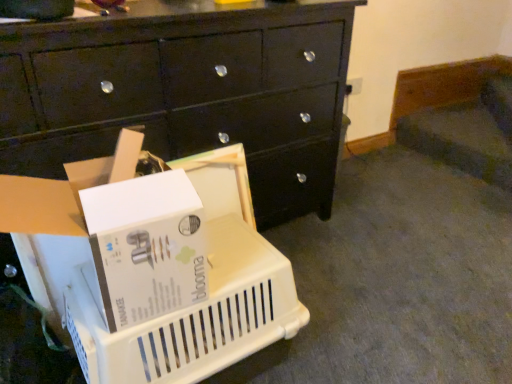
In order to face black glossy chest of drawers at center, should I rotate leftwards or rightwards?

Rotate left and turn 10.544 degrees.

Identify the location of white plastic storage box at lower left. This screenshot has width=512, height=384. (120, 231).

Considering the sizes of white plastic storage box at lower left and black glossy chest of drawers at center in the image, is white plastic storage box at lower left taller or shorter than black glossy chest of drawers at center?

white plastic storage box at lower left is shorter than black glossy chest of drawers at center.

From the picture: Is the position of white plastic storage box at lower left less distant than that of black glossy chest of drawers at center?

Yes, it is.

Consider the image. Is white plastic storage box at lower left with black glossy chest of drawers at center?

No, white plastic storage box at lower left is not beside black glossy chest of drawers at center.

Identify the location of storage box that appears on the left of black glossy chest of drawers at center. (120, 231).

How different are the orientations of white plastic basket at lower left and black glossy chest of drawers at center in degrees?

The angle between the facing direction of white plastic basket at lower left and the facing direction of black glossy chest of drawers at center is 0.556 degrees.

From a real-world perspective, does white plastic basket at lower left sit lower than black glossy chest of drawers at center?

Indeed, from a real-world perspective, white plastic basket at lower left is positioned beneath black glossy chest of drawers at center.

Considering the sizes of objects white plastic basket at lower left and black glossy chest of drawers at center in the image provided, who is bigger, white plastic basket at lower left or black glossy chest of drawers at center?

black glossy chest of drawers at center is bigger.

From the image's perspective, is white plastic basket at lower left positioned above or below black glossy chest of drawers at center?

→ From the image's perspective, white plastic basket at lower left appears below black glossy chest of drawers at center.

Which is in front, white plastic storage box at lower left or white plastic basket at lower left?

white plastic storage box at lower left is closer to the camera.

Which is correct: white plastic storage box at lower left is inside white plastic basket at lower left, or outside of it?

white plastic storage box at lower left cannot be found inside white plastic basket at lower left.

Between white plastic storage box at lower left and white plastic basket at lower left, which one has smaller width?

white plastic storage box at lower left.

From their relative heights in the image, would you say white plastic basket at lower left is taller or shorter than white plastic storage box at lower left?

Clearly, white plastic basket at lower left is taller compared to white plastic storage box at lower left.

Is white plastic basket at lower left next to white plastic storage box at lower left?

No, white plastic basket at lower left is not in contact with white plastic storage box at lower left.

Is white plastic basket at lower left oriented towards white plastic storage box at lower left?

No, white plastic basket at lower left is not aimed at white plastic storage box at lower left.

Considering the sizes of white plastic basket at lower left and white plastic storage box at lower left in the image, is white plastic basket at lower left wider or thinner than white plastic storage box at lower left?

Considering their sizes, white plastic basket at lower left looks broader than white plastic storage box at lower left.

Considering the sizes of black glossy chest of drawers at center and white plastic basket at lower left in the image, is black glossy chest of drawers at center taller or shorter than white plastic basket at lower left?

Considering their sizes, black glossy chest of drawers at center has more height than white plastic basket at lower left.

Is black glossy chest of drawers at center positioned beyond the bounds of white plastic basket at lower left?

black glossy chest of drawers at center is positioned outside white plastic basket at lower left.

Does point (222, 59) come in front of point (110, 244)?

No.

Consider the image. Can you tell me how much black glossy chest of drawers at center and white plastic storage box at lower left differ in facing direction?

1.29 degrees separate the facing orientations of black glossy chest of drawers at center and white plastic storage box at lower left.

Is black glossy chest of drawers at center oriented towards white plastic storage box at lower left?

Yes, black glossy chest of drawers at center is facing white plastic storage box at lower left.

Is point (9, 91) positioned behind point (148, 249)?

Yes, it is.

Where is `the chest of drawers above the white plastic storage box at lower left (from the image's perspective)`? Image resolution: width=512 pixels, height=384 pixels. the chest of drawers above the white plastic storage box at lower left (from the image's perspective) is located at coordinates (186, 91).

Image resolution: width=512 pixels, height=384 pixels. Identify the location of chest of drawers behind the white plastic storage box at lower left. pyautogui.click(x=186, y=91).

Find the location of a particular element. basket on the right of black glossy chest of drawers at center is located at coordinates (178, 276).

From the image, which object appears to be nearer to black glossy chest of drawers at center, white plastic basket at lower left or white plastic storage box at lower left?

white plastic basket at lower left.

When comparing their distances from white plastic storage box at lower left, does black glossy chest of drawers at center or white plastic basket at lower left seem closer?

white plastic basket at lower left.

Which object lies further to the anchor point white plastic basket at lower left, white plastic storage box at lower left or black glossy chest of drawers at center?

The object further to white plastic basket at lower left is black glossy chest of drawers at center.

Estimate the real-world distances between objects in this image. Which object is further from black glossy chest of drawers at center, white plastic storage box at lower left or white plastic basket at lower left?

Based on the image, white plastic storage box at lower left appears to be further to black glossy chest of drawers at center.

Looking at the image, which one is located closer to white plastic basket at lower left, black glossy chest of drawers at center or white plastic storage box at lower left?

Among the two, white plastic storage box at lower left is located nearer to white plastic basket at lower left.

Looking at the image, which one is located further to white plastic storage box at lower left, white plastic basket at lower left or black glossy chest of drawers at center?

black glossy chest of drawers at center.

Where is `storage box between black glossy chest of drawers at center and white plastic basket at lower left in the vertical direction`? storage box between black glossy chest of drawers at center and white plastic basket at lower left in the vertical direction is located at coordinates (120, 231).